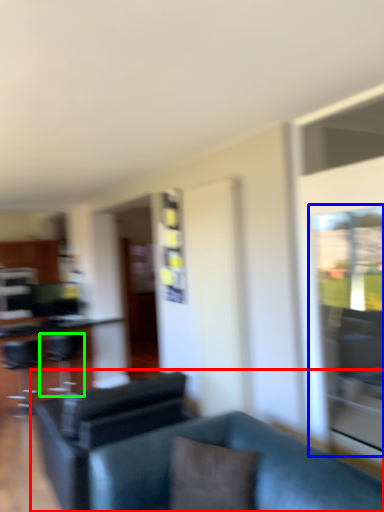
Question: Estimate the real-world distances between objects in this image. Which object is farther from studio couch (highlighted by a red box), glass door (highlighted by a blue box) or swivel chair (highlighted by a green box)?

Choices:
 (A) glass door
 (B) swivel chair

Answer: (B)